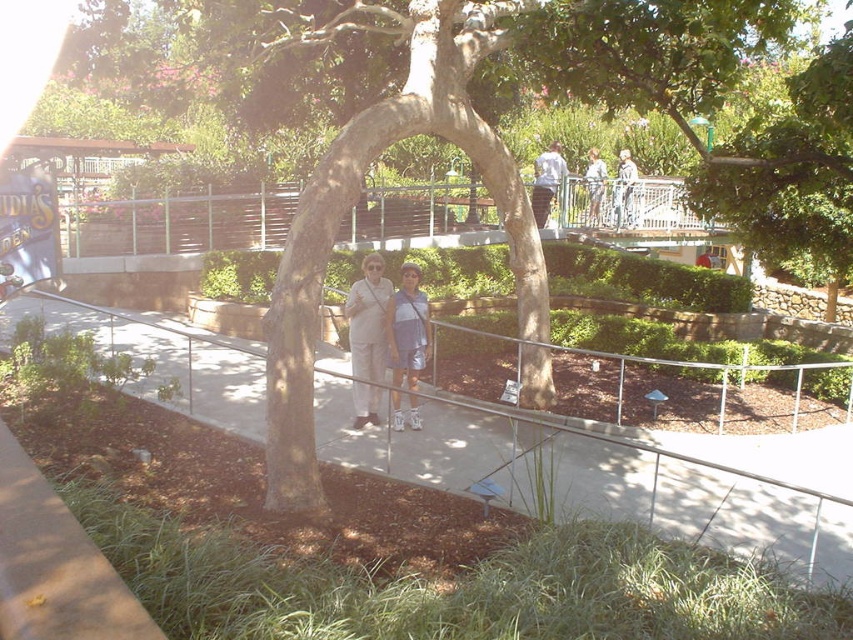
Question: Which of these objects is positioned closest to the light beige pants at center?

Choices:
 (A) smooth concrete path at center
 (B) matte blue dress at center

Answer: (B)

Question: Is metallic silver railing at upper center thinner than white cotton shirt at upper center?

Choices:
 (A) no
 (B) yes

Answer: (A)

Question: Does green textured tree at center have a smaller size compared to light blue denim shorts at center?

Choices:
 (A) yes
 (B) no

Answer: (B)

Question: Does metallic silver railing at upper center appear on the right side of light blue denim shorts at center?

Choices:
 (A) yes
 (B) no

Answer: (B)

Question: Estimate the real-world distances between objects in this image. Which object is farther from the matte blue dress at center?

Choices:
 (A) smooth concrete path at center
 (B) green textured tree at center

Answer: (B)

Question: Which object is farther from the camera taking this photo?

Choices:
 (A) metallic silver statue at upper center
 (B) green leafy tree at upper center

Answer: (A)